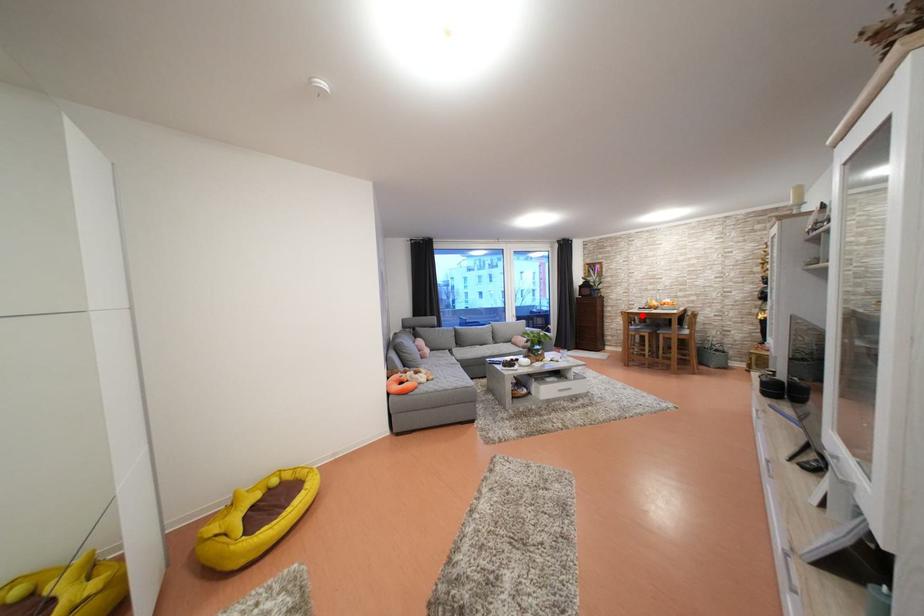
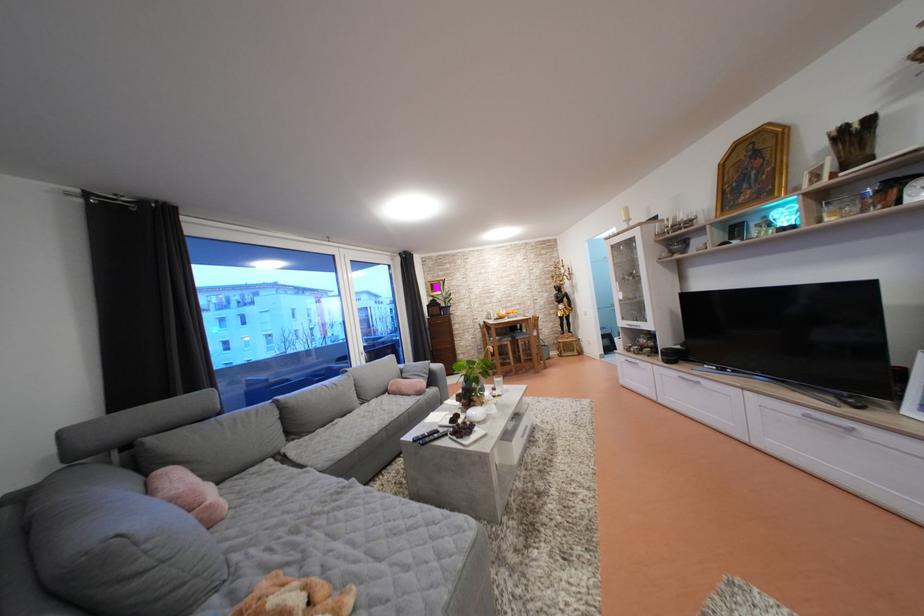
Where in the second image is the point corresponding to the highlighted location from the first image?

(497, 328)